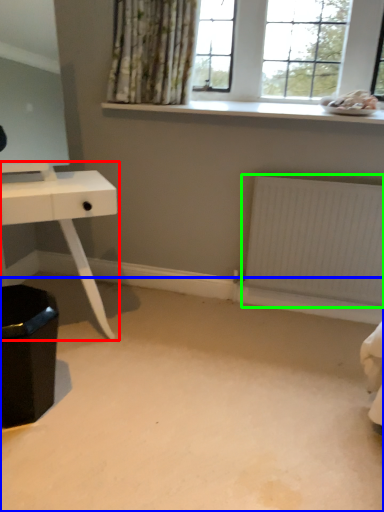
Question: Based on their relative distances, which object is farther from table (highlighted by a red box)? Choose from plain (highlighted by a blue box) and radiator (highlighted by a green box).

Choices:
 (A) plain
 (B) radiator

Answer: (B)